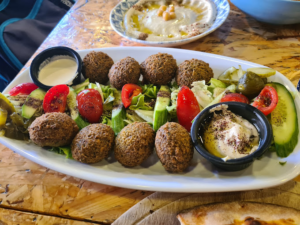
Image resolution: width=300 pixels, height=225 pixels. Identify the location of plate. (120, 21), (123, 180), (122, 175).